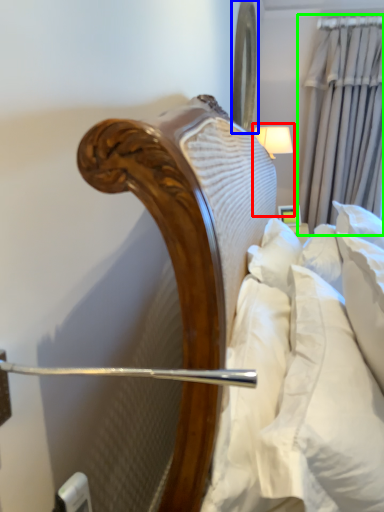
Question: Estimate the real-world distances between objects in this image. Which object is farther from bedside lamp (highlighted by a red box), mirror (highlighted by a blue box) or curtain (highlighted by a green box)?

Choices:
 (A) mirror
 (B) curtain

Answer: (B)